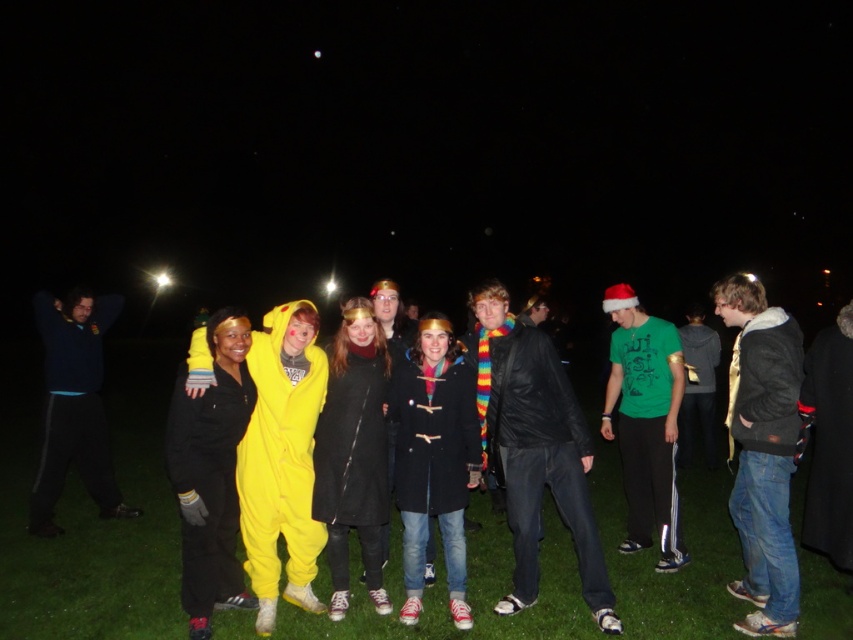
Question: Which of the following is the closest to the observer?

Choices:
 (A) green matte t-shirt at center-right
 (B) green grass at center

Answer: (A)

Question: Observing the image, what is the correct spatial positioning of green grass at center in reference to green matte t-shirt at center-right?

Choices:
 (A) left
 (B) right

Answer: (B)

Question: Which object is closer to the camera taking this photo?

Choices:
 (A) green grass at center
 (B) green matte t-shirt at center-right

Answer: (B)

Question: Does green grass at center have a larger size compared to green matte t-shirt at center-right?

Choices:
 (A) no
 (B) yes

Answer: (A)

Question: Which of the following is the closest to the observer?

Choices:
 (A) green grass at center
 (B) green matte t-shirt at center-right

Answer: (B)

Question: Can you confirm if green grass at center is positioned above green matte t-shirt at center-right?

Choices:
 (A) yes
 (B) no

Answer: (B)